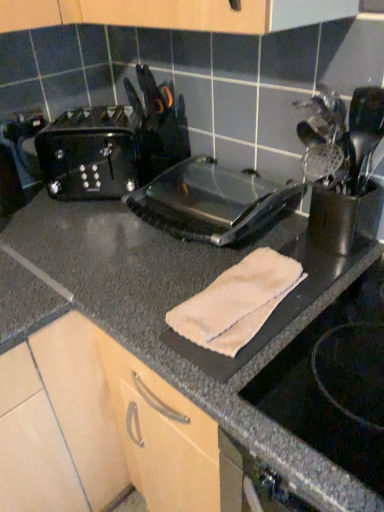
The image size is (384, 512). I want to click on vacant space situated on the left part of transparent plastic toaster at center, so click(90, 247).